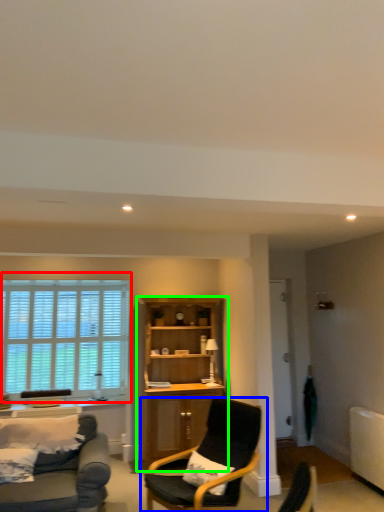
Question: Based on their relative distances, which object is nearer to window (highlighted by a red box)? Choose from chair (highlighted by a blue box) and cabinetry (highlighted by a green box).

Choices:
 (A) chair
 (B) cabinetry

Answer: (B)